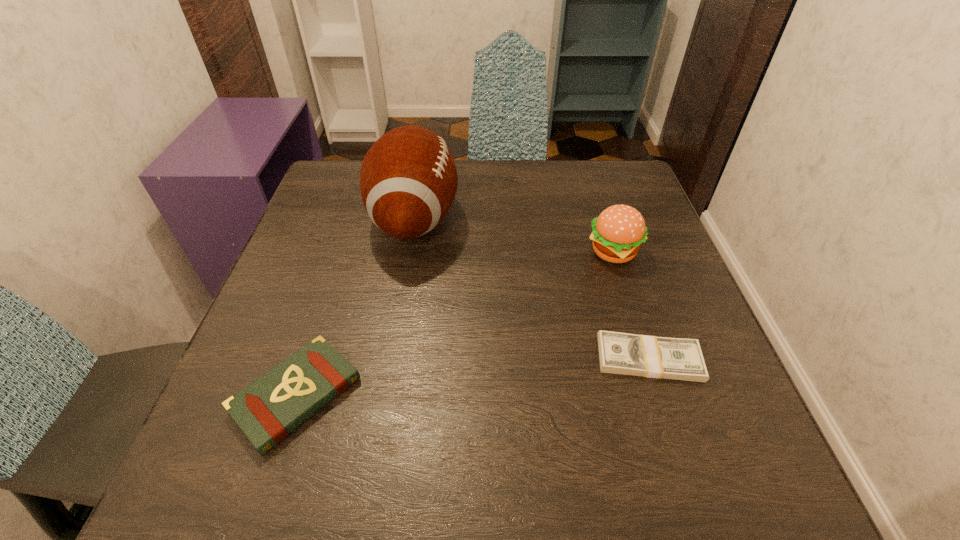
The width and height of the screenshot is (960, 540). I want to click on free location at the near right corner of the desktop, so click(x=752, y=441).

Find the location of a particular element. vacant point located between the dollar and the hamburger is located at coordinates (632, 305).

Where is `free space between the third shortest object and the dollar`? free space between the third shortest object and the dollar is located at coordinates (632, 305).

Identify the location of vacant area that lies between the book and the dollar. The height and width of the screenshot is (540, 960). (472, 377).

The image size is (960, 540). What are the coordinates of `empty space between the tallest object and the third shortest object` in the screenshot? It's located at (515, 235).

What are the coordinates of `empty space that is in between the third tallest object and the hamburger` in the screenshot? It's located at (455, 323).

The height and width of the screenshot is (540, 960). In order to click on free space between the tallest object and the dollar in this screenshot , I will do `click(532, 289)`.

Image resolution: width=960 pixels, height=540 pixels. What are the coordinates of `vacant space that is in between the third tallest object and the shortest object` in the screenshot? It's located at (472, 377).

Locate an element on the screen. The image size is (960, 540). vacant area between the book and the football is located at coordinates pos(355,307).

Image resolution: width=960 pixels, height=540 pixels. I want to click on vacant space that's between the hamburger and the second shortest object, so click(x=455, y=323).